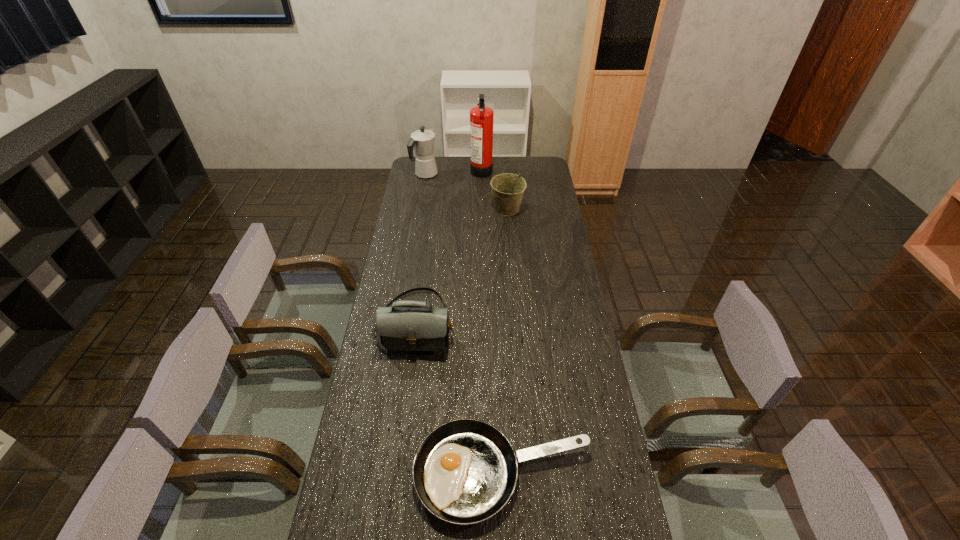
Find the location of a particular element. The width and height of the screenshot is (960, 540). the tallest object is located at coordinates (481, 117).

You are a GUI agent. You are given a task and a screenshot of the screen. Output one action in this format:
    pyautogui.click(x=<x>, y=<y>)
    Task: Click on the coffeepot
    
    Given the screenshot: What is the action you would take?
    pyautogui.click(x=422, y=141)

Find the location of `the third farthest object`. the third farthest object is located at coordinates (508, 189).

This screenshot has height=540, width=960. What are the coordinates of `the second nearest object` in the screenshot? It's located at (415, 328).

Where is `the second shortest object`? the second shortest object is located at coordinates (415, 328).

Locate an element on the screen. the shortest object is located at coordinates (465, 471).

Where is `the nearest object`? This screenshot has height=540, width=960. the nearest object is located at coordinates (465, 471).

Find the location of a particular element. The height and width of the screenshot is (540, 960). vacant position located on the front-facing side of the tallest object is located at coordinates (417, 169).

The height and width of the screenshot is (540, 960). I want to click on free point located on the front-facing side of the tallest object, so click(x=458, y=169).

You are a GUI agent. You are given a task and a screenshot of the screen. Output one action in this format:
    pyautogui.click(x=<x>, y=<y>)
    Task: Click on the free spot located 0.200m on the front-facing side of the tallest object
    Image resolution: width=960 pixels, height=540 pixels.
    Given the screenshot: What is the action you would take?
    pyautogui.click(x=434, y=169)